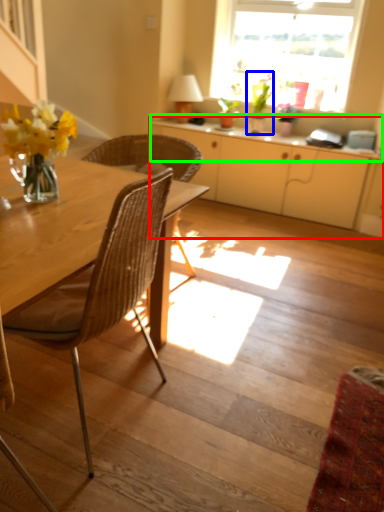
Question: Which object is positioned closest to cabinetry (highlighted by a red box)? Select from houseplant (highlighted by a blue box) and counter top (highlighted by a green box).

Choices:
 (A) houseplant
 (B) counter top

Answer: (B)